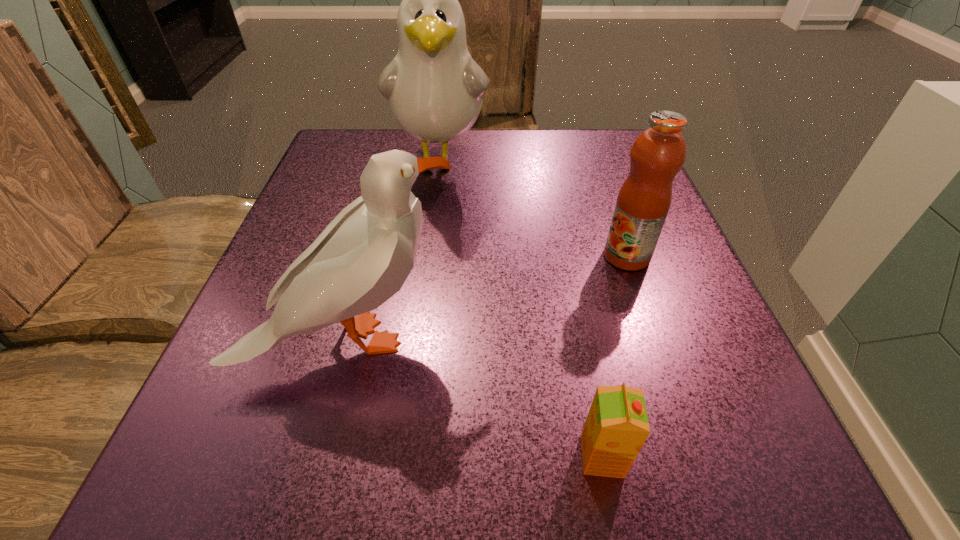
What are the coordinates of `blank space that satisfies the following two spatial constraints: 1. on the beak of the nearest object; 2. on the right side of the farther gull` in the screenshot? It's located at (404, 456).

Image resolution: width=960 pixels, height=540 pixels. Identify the location of free location that satisfies the following two spatial constraints: 1. on the beak of the farthest object; 2. at the beak of the shorter gull. (x=419, y=339).